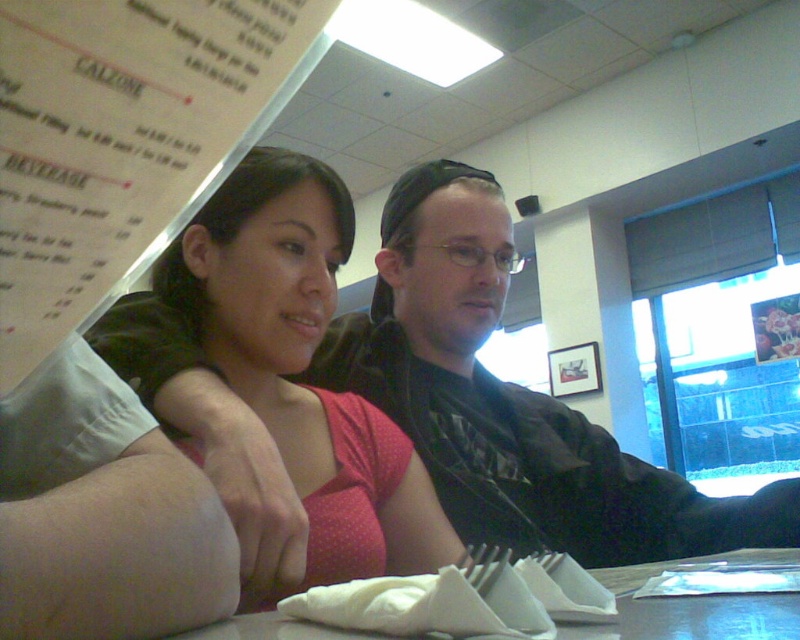
Is white paper menu at upper left taller than pink dotted fabric at center?

In fact, white paper menu at upper left may be shorter than pink dotted fabric at center.

Can you confirm if white paper menu at upper left is positioned to the right of pink dotted fabric at center?

Yes, white paper menu at upper left is to the right of pink dotted fabric at center.

Where is `white paper menu at upper left`? white paper menu at upper left is located at coordinates (120, 141).

Does pink dotted fabric at center appear over white paper napkin at lower center?

Indeed, pink dotted fabric at center is positioned over white paper napkin at lower center.

Is pink dotted fabric at center positioned behind white paper napkin at lower center?

Yes, it is behind white paper napkin at lower center.

Which is behind, point (230, 260) or point (796, 605)?

The point (230, 260) is more distant.

This screenshot has width=800, height=640. What are the coordinates of `pink dotted fabric at center` in the screenshot? It's located at (280, 364).

Is white paper menu at upper left wider than white paper napkin at lower center?

In fact, white paper menu at upper left might be narrower than white paper napkin at lower center.

Based on the photo, between white paper menu at upper left and white paper napkin at lower center, which one is positioned lower?

Positioned lower is white paper napkin at lower center.

Is point (256, 68) behind point (248, 630)?

No, it is not.

What are the coordinates of `white paper menu at upper left` in the screenshot? It's located at (x=120, y=141).